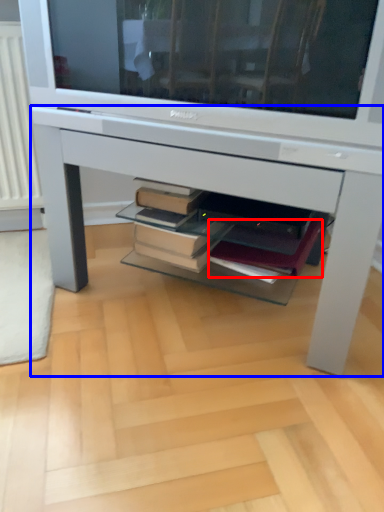
Question: Which object appears farthest to the camera in this image, paperback book (highlighted by a red box) or desk (highlighted by a blue box)?

Choices:
 (A) paperback book
 (B) desk

Answer: (A)